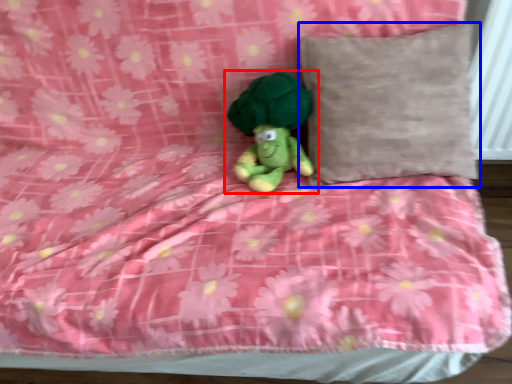
Question: Which of the following is the closest to the observer, toy (highlighted by a red box) or pillow (highlighted by a blue box)?

Choices:
 (A) toy
 (B) pillow

Answer: (B)